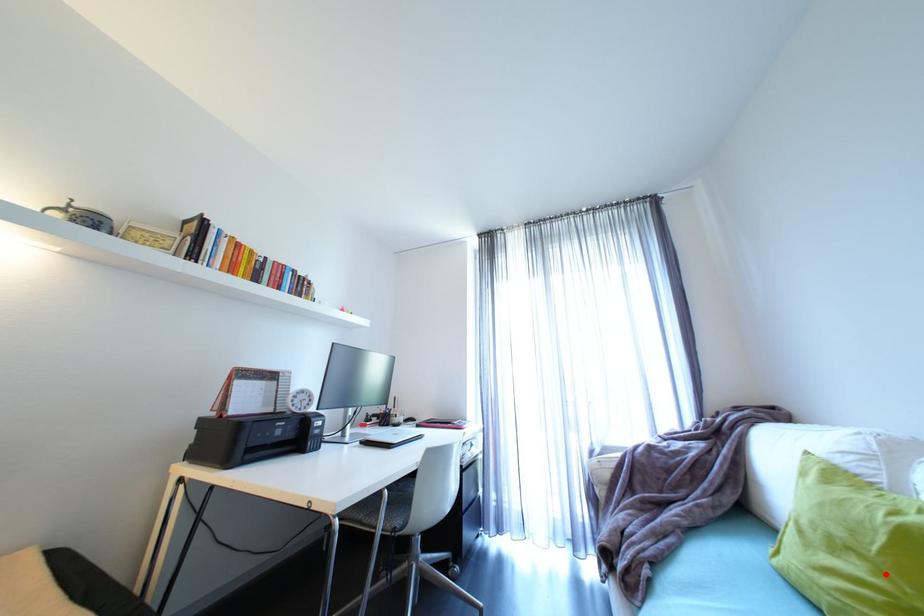
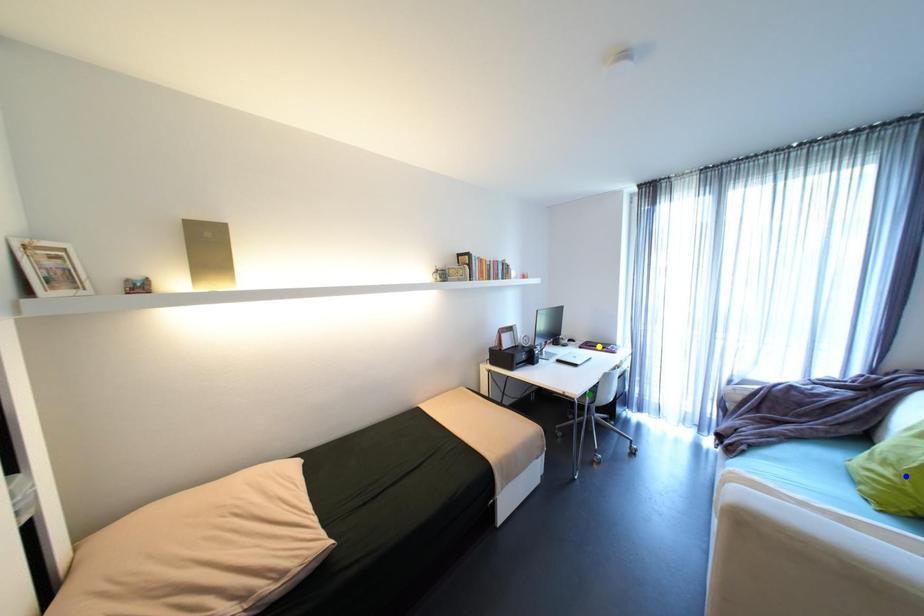
Question: I am providing you with two images of the same scene from different viewpoints. A red point is marked on the first image. You are given multiple points on the second image. Can you choose the point in image 2 that corresponds to the point in image 1?

Choices:
 (A) blue point
 (B) green point
 (C) yellow point

Answer: (A)